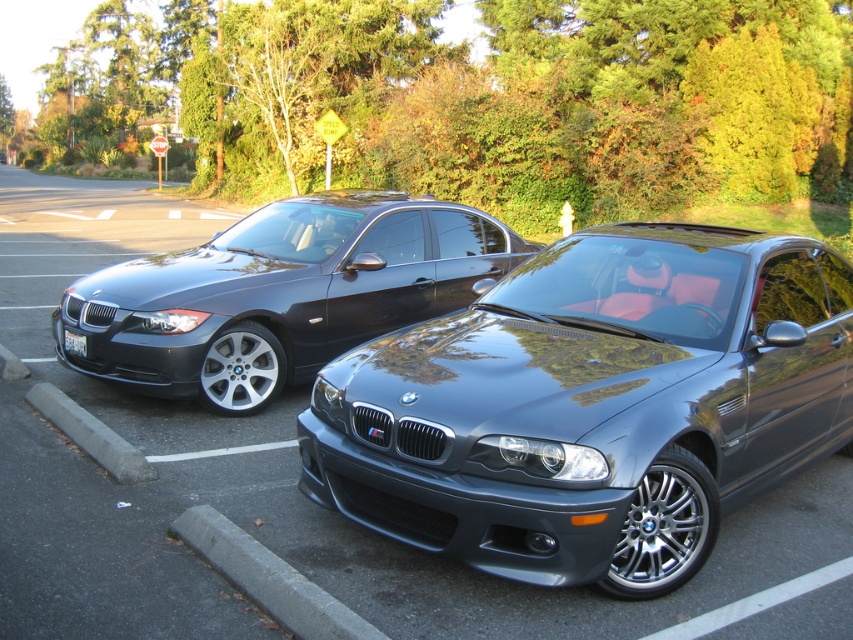
You are a driver trying to park your car in the parking lot. You see the satin black sedan at left and the gray concrete curb at lower center. Which object is positioned higher in the image?

The satin black sedan at left is above the gray concrete curb at lower center, so the satin black sedan at left is positioned higher in the image.

You are a delivery robot that needs to place a package on the gray concrete curb at lower center. However, you can only lift the package up to the height of the white plastic license plate at lower left. Can you successfully place the package on the curb?

The gray concrete curb at lower center has a greater height compared to the white plastic license plate at lower left. Since the robot can only lift the package up to the height of the white plastic license plate at lower left, it cannot reach the higher gray concrete curb at lower center to place the package.